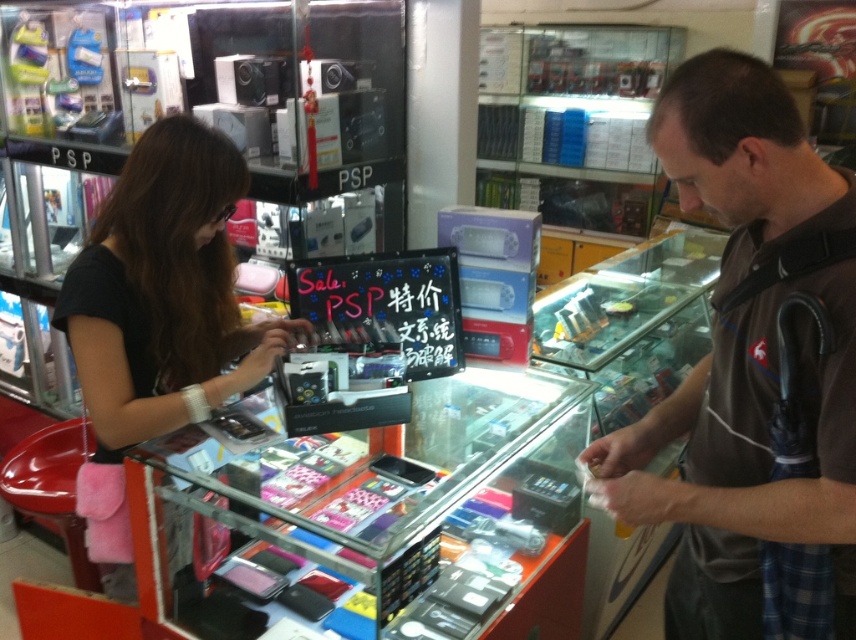
Question: Which of the following is the farthest from the observer?

Choices:
 (A) black matte purse at left
 (B) brown cotton shirt at center

Answer: (A)

Question: Can you confirm if brown cotton shirt at center is positioned to the left of black matte purse at left?

Choices:
 (A) no
 (B) yes

Answer: (A)

Question: Which point is farther from the camera taking this photo?

Choices:
 (A) (140, 275)
 (B) (815, 170)

Answer: (A)

Question: Which point is farther to the camera?

Choices:
 (A) brown cotton shirt at center
 (B) black matte purse at left

Answer: (B)

Question: Does brown cotton shirt at center come behind black matte purse at left?

Choices:
 (A) yes
 (B) no

Answer: (B)

Question: Is brown cotton shirt at center thinner than black matte purse at left?

Choices:
 (A) no
 (B) yes

Answer: (B)